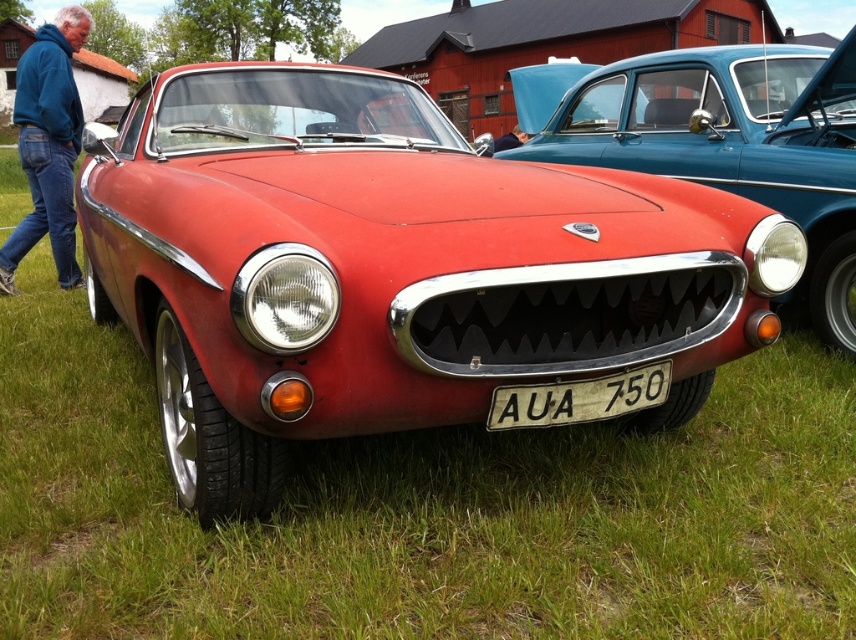
You are a photographer at a car show and want to capture the blue fleece jacket at upper left and the white plastic license plate at center in the same frame. Which object should you focus on first if you want to ensure both are in focus?

The blue fleece jacket at upper left is located above the white plastic license plate at center, so focusing on the white plastic license plate at center first would ensure both are in focus since it is closer to the camera.

You are standing at the point where the car show organizer is directing visitors. You see the point marked at (734, 145). Is this point located on the matte black car at center?

The point at (734, 145) is located on the matte black car at center as stated in the objects description.

You are standing at the front of the vintage red car and want to locate two specific points marked on its body. The first point is at coordinates point (60, 260) and the second point is at point (632, 372). Which point is closer to you?

Point (60, 260) is behind point (632, 372), so the point closer to you is point (632, 372).